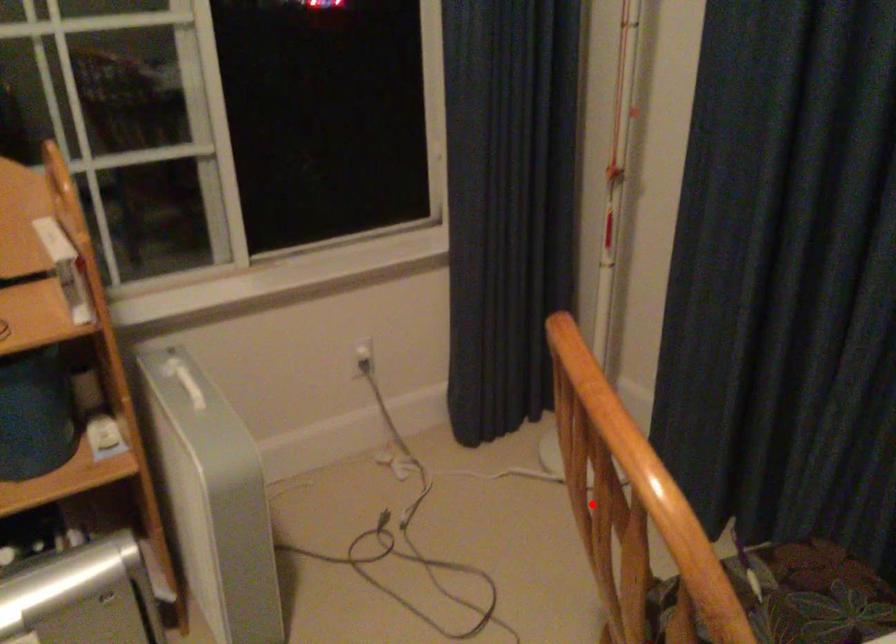
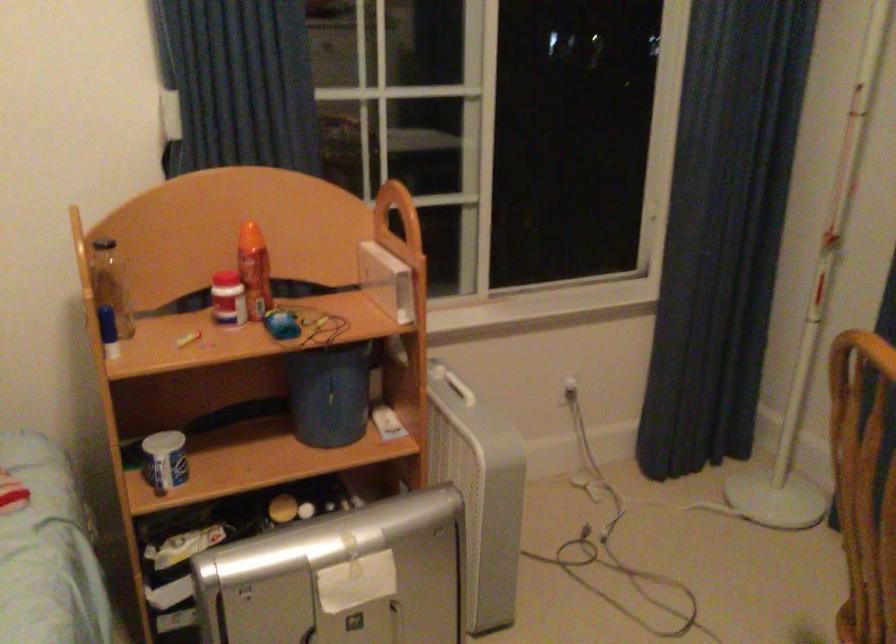
Where in the second image is the point corresponding to the highlighted location from the first image?

(864, 484)